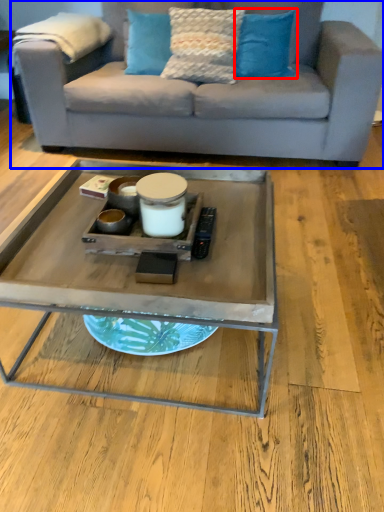
Question: Which point is further to the camera, pillow (highlighted by a red box) or studio couch (highlighted by a blue box)?

Choices:
 (A) pillow
 (B) studio couch

Answer: (A)